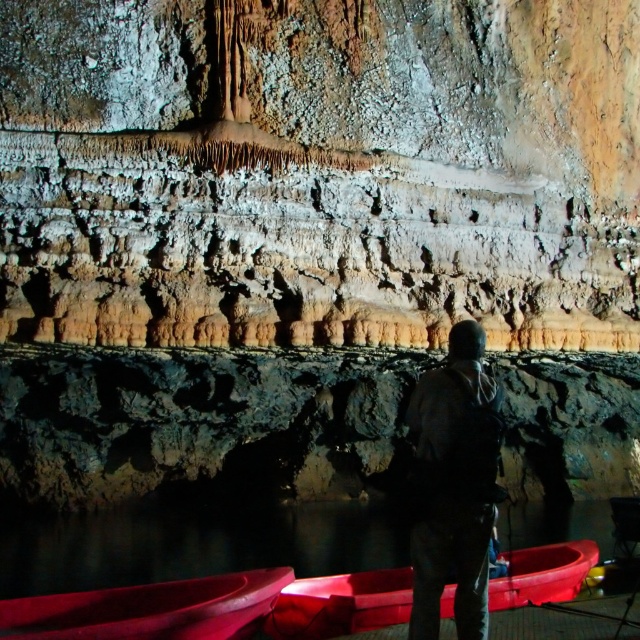
Question: Does dark gray fabric jacket at center have a lesser width compared to rubber boat at lower center?

Choices:
 (A) no
 (B) yes

Answer: (B)

Question: Is dark gray fabric jacket at center bigger than rubber boat at lower left?

Choices:
 (A) yes
 (B) no

Answer: (B)

Question: Among these points, which one is nearest to the camera?

Choices:
 (A) (106, 632)
 (B) (480, 524)
 (C) (301, 596)

Answer: (A)

Question: Which object is closer to the camera taking this photo?

Choices:
 (A) rubber boat at lower left
 (B) rubber boat at lower center
 (C) dark gray fabric jacket at center

Answer: (B)

Question: Which point is closer to the camera?

Choices:
 (A) (317, 584)
 (B) (253, 614)
 (C) (444, 492)

Answer: (B)

Question: Is dark gray fabric jacket at center positioned at the back of rubber boat at lower center?

Choices:
 (A) no
 (B) yes

Answer: (B)